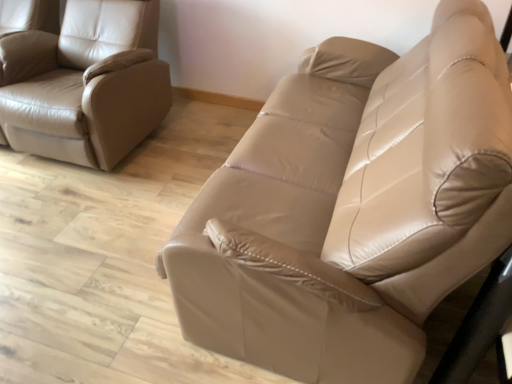
Question: From a real-world perspective, does matte leather couch at center stand above matte leather chair at left?

Choices:
 (A) yes
 (B) no

Answer: (A)

Question: Would you say matte leather couch at center is a long distance from matte leather chair at left?

Choices:
 (A) yes
 (B) no

Answer: (A)

Question: From the image's perspective, is matte leather couch at center beneath matte leather chair at left?

Choices:
 (A) yes
 (B) no

Answer: (A)

Question: Does matte leather couch at center appear on the left side of matte leather chair at left?

Choices:
 (A) no
 (B) yes

Answer: (A)

Question: Is matte leather couch at center smaller than matte leather chair at left?

Choices:
 (A) no
 (B) yes

Answer: (A)

Question: Is matte leather chair at left at the back of matte leather couch at center?

Choices:
 (A) yes
 (B) no

Answer: (B)

Question: From a real-world perspective, is matte leather chair at left physically below matte leather couch at center?

Choices:
 (A) yes
 (B) no

Answer: (A)

Question: Is matte leather couch at center surrounded by matte leather chair at left?

Choices:
 (A) no
 (B) yes

Answer: (A)

Question: Considering the relative positions of matte leather chair at left and matte leather couch at center in the image provided, is matte leather chair at left to the left of matte leather couch at center from the viewer's perspective?

Choices:
 (A) no
 (B) yes

Answer: (B)

Question: From the image's perspective, would you say matte leather chair at left is positioned over matte leather couch at center?

Choices:
 (A) yes
 (B) no

Answer: (A)

Question: Does matte leather chair at left have a lesser height compared to matte leather couch at center?

Choices:
 (A) yes
 (B) no

Answer: (A)

Question: Considering the relative positions of matte leather chair at left and matte leather couch at center in the image provided, is matte leather chair at left in front of matte leather couch at center?

Choices:
 (A) yes
 (B) no

Answer: (B)

Question: From the image's perspective, is matte leather chair at left located above or below matte leather couch at center?

Choices:
 (A) above
 (B) below

Answer: (A)